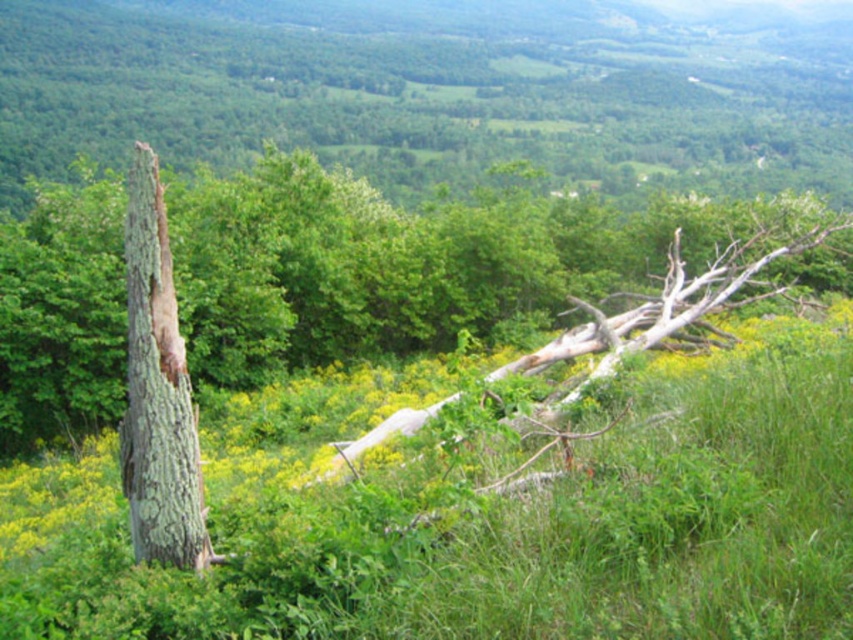
You are standing in the lush green landscape described. You notice a point marked at coordinates (402, 264). Which object from the scene does this point correspond to?

The point at coordinates (402, 264) corresponds to the smooth bark tree trunk at left.

Looking at this image, you are standing in the middle of the landscape and want to place a small garden ornament. You have two options for placement spots. The first is near the green grassy at center, and the second is near the smooth bark tree trunk at left. Which location would be closer to you as you stand in the middle?

The green grassy at center is closer to the viewer than the smooth bark tree trunk at left, so placing the ornament near the green grassy at center would be closer to you.